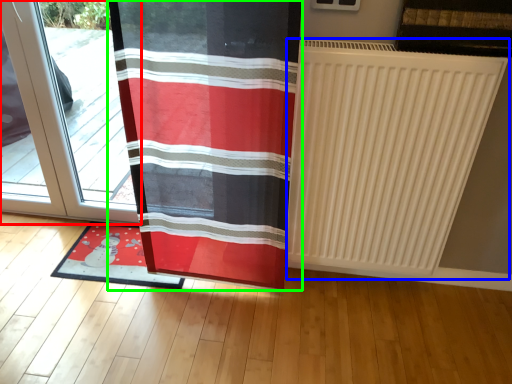
Question: Based on their relative distances, which object is nearer to door (highlighted by a red box)? Choose from radiator (highlighted by a blue box) and curtain (highlighted by a green box).

Choices:
 (A) radiator
 (B) curtain

Answer: (B)